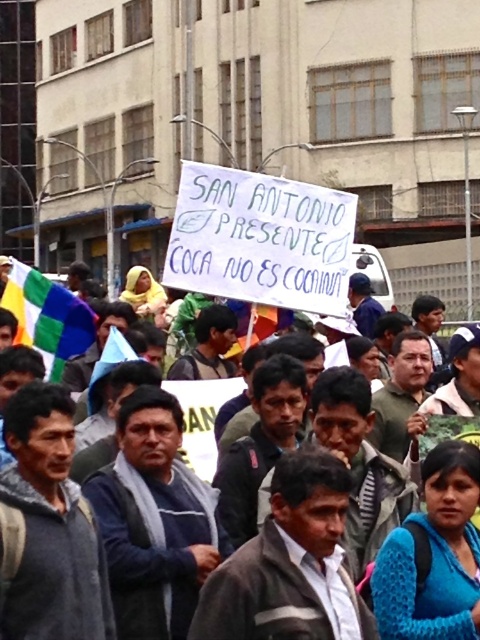
Question: Does white paper sign at center appear on the right side of multicolored fabric flag at left?

Choices:
 (A) no
 (B) yes

Answer: (B)

Question: Which point appears farthest from the camera in this image?

Choices:
 (A) (416, 401)
 (B) (67, 300)

Answer: (B)

Question: Which object appears closest to the camera in this image?

Choices:
 (A) multicolored fabric flag at left
 (B) white paper sign at center

Answer: (B)

Question: Where is white paper sign at center located in relation to multicolored fabric flag at left in the image?

Choices:
 (A) above
 (B) below

Answer: (A)

Question: Which point appears farthest from the camera in this image?

Choices:
 (A) (20, 262)
 (B) (68, 336)

Answer: (A)

Question: Considering the relative positions of white paper sign at center and multicolored fabric flag at left in the image provided, where is white paper sign at center located with respect to multicolored fabric flag at left?

Choices:
 (A) below
 (B) above

Answer: (B)